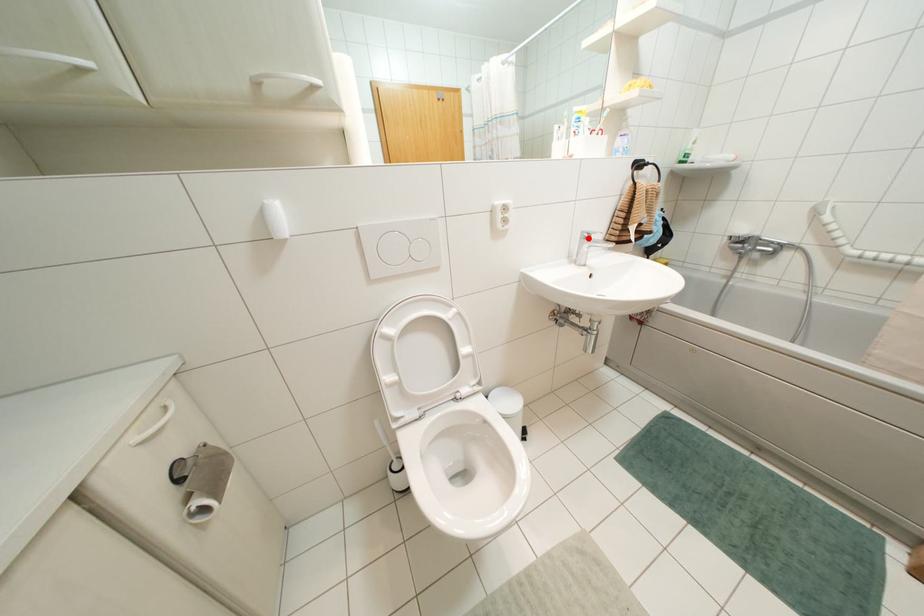
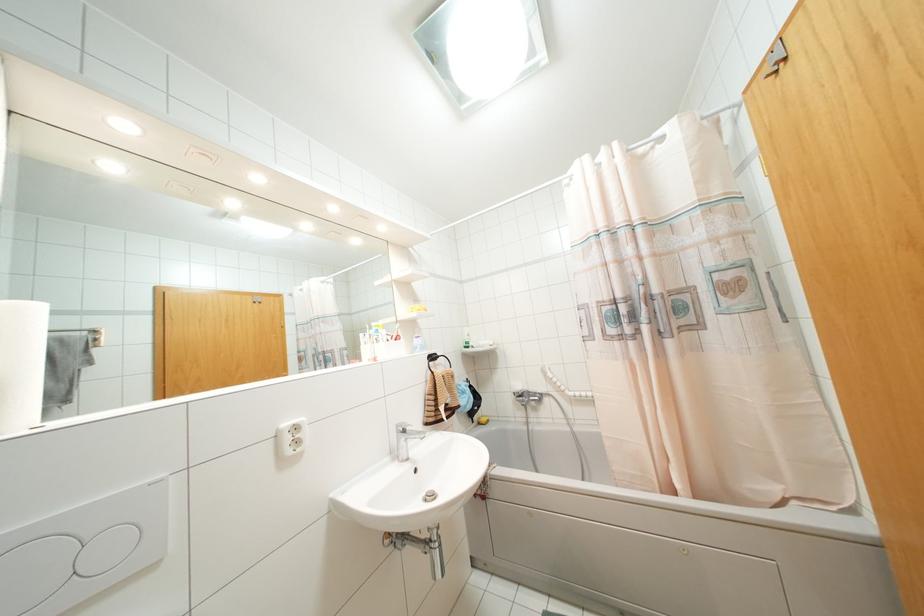
In the second image, find the point that corresponds to the highlighted location in the first image.

(404, 431)